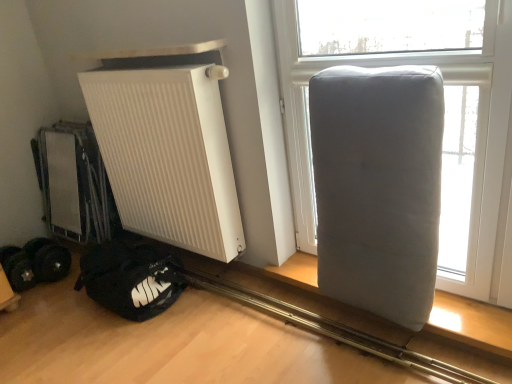
The image size is (512, 384). Identify the location of vacant area that is in front of black rubber weights at lower left. (23, 297).